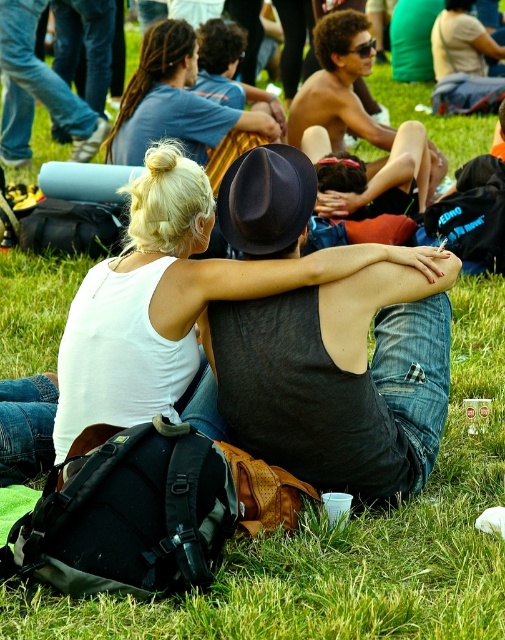
Image resolution: width=505 pixels, height=640 pixels. Describe the element at coordinates (339, 376) in the screenshot. I see `white matte tank top at center` at that location.

Is point (279, 248) positioned after point (28, 88)?

No.

Is point (381, 484) closer to camera compared to point (14, 102)?

Yes, it is.

The image size is (505, 640). Identify the location of white matte tank top at center. (339, 376).

Describe the element at coordinates (356, 116) in the screenshot. I see `shiny black hat at center` at that location.

Which is more to the right, shiny black hat at center or jeans at center?

From the viewer's perspective, shiny black hat at center appears more on the right side.

This screenshot has width=505, height=640. What do you see at coordinates (356, 116) in the screenshot?
I see `shiny black hat at center` at bounding box center [356, 116].

You are a GUI agent. You are given a task and a screenshot of the screen. Output one action in this format:
    pyautogui.click(x=<x>, y=<y>)
    Task: Click on the shiny black hat at center
    
    Given the screenshot: What is the action you would take?
    pyautogui.click(x=356, y=116)

Is white matte tank top at center above shiny black hat at center?

No, white matte tank top at center is not above shiny black hat at center.

Is point (393, 349) in front of point (380, 192)?

Yes, point (393, 349) is closer to viewer.

Where is `white matte tank top at center`? This screenshot has height=640, width=505. white matte tank top at center is located at coordinates (339, 376).